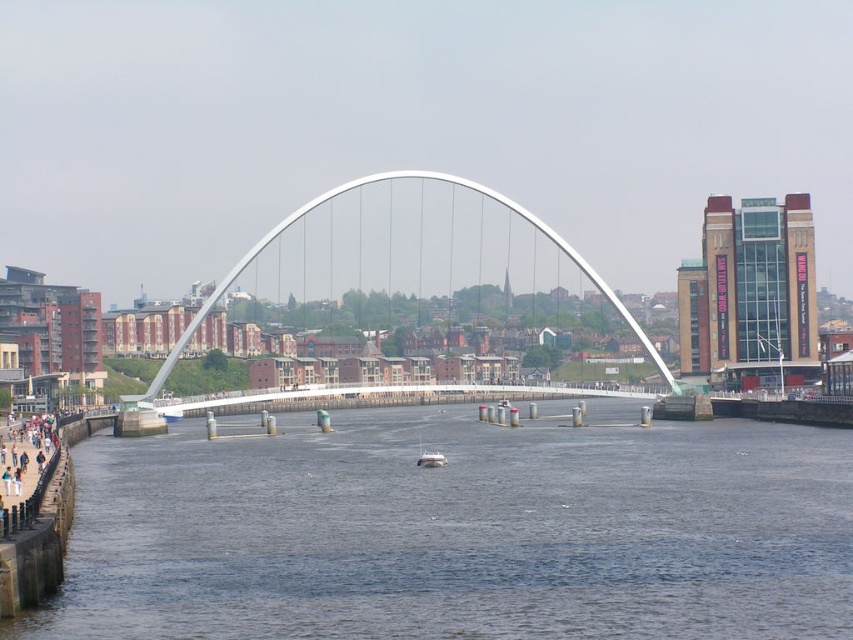
You are a photographer planning to capture the white metallic arch bridge at center and the dark blue water at center in a single shot. Based on their heights, which one will appear taller in the photograph?

The white metallic arch bridge at center appears taller than the dark blue water at center in the photograph because the description states that the dark blue water at center is not as tall as the white metallic arch bridge at center.

You are standing on the waterfront promenade and want to take a photo of the white metallic arch bridge at center. However, the dark blue water at center is blocking your view. Can you adjust your position to capture the bridge without the water obstructing it?

The dark blue water at center is closer to the viewer than the white metallic arch bridge at center. To avoid the water obstructing the view, you can move to a higher elevation or shift your position to the side so that the bridge appears above or beside the water in your frame.